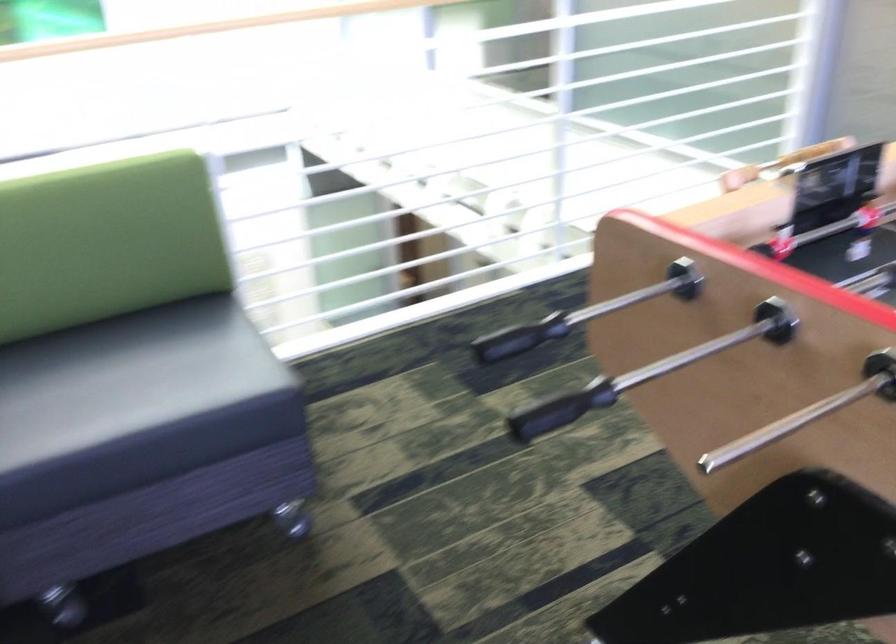
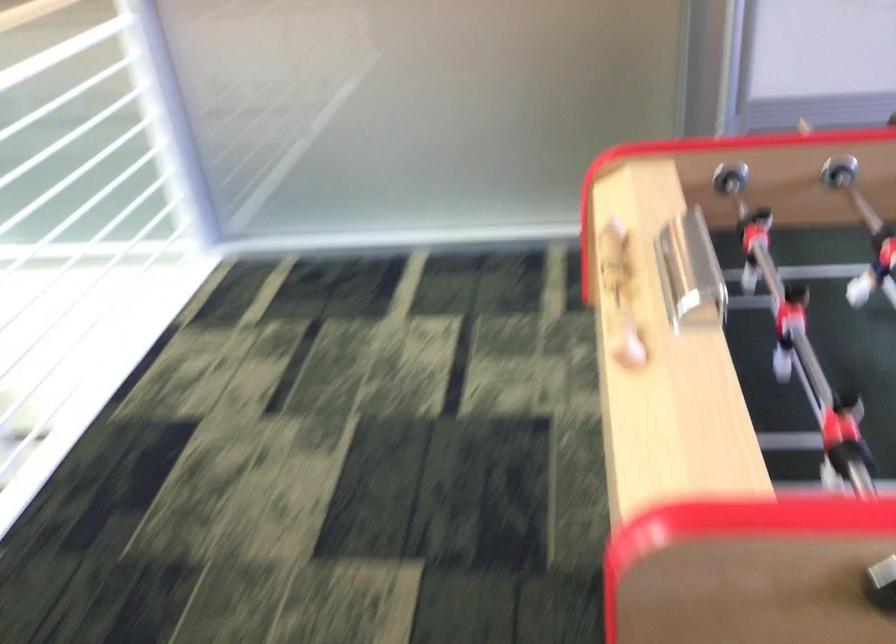
Locate, in the second image, the point that corresponds to the point at 737,176 in the first image.

(626, 343)